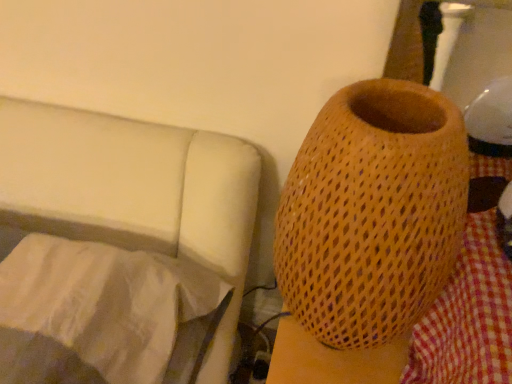
Question: Considering the relative positions of brown woven vase at right and white fabric at lower left in the image provided, is brown woven vase at right to the left of white fabric at lower left from the viewer's perspective?

Choices:
 (A) yes
 (B) no

Answer: (B)

Question: Is brown woven vase at right completely or partially outside of white fabric at lower left?

Choices:
 (A) yes
 (B) no

Answer: (A)

Question: Can you confirm if brown woven vase at right is shorter than white fabric at lower left?

Choices:
 (A) yes
 (B) no

Answer: (B)

Question: Is white fabric at lower left a part of brown woven vase at right?

Choices:
 (A) yes
 (B) no

Answer: (B)

Question: From a real-world perspective, is brown woven vase at right located higher than white fabric at lower left?

Choices:
 (A) no
 (B) yes

Answer: (B)

Question: From the image's perspective, is brown woven vase at right below white fabric at lower left?

Choices:
 (A) no
 (B) yes

Answer: (A)

Question: From the image's perspective, does white fabric at lower left appear lower than brown woven vase at right?

Choices:
 (A) yes
 (B) no

Answer: (A)

Question: From a real-world perspective, is white fabric at lower left physically below brown woven vase at right?

Choices:
 (A) no
 (B) yes

Answer: (B)

Question: Does white fabric at lower left have a greater height compared to brown woven vase at right?

Choices:
 (A) no
 (B) yes

Answer: (A)

Question: Considering the relative positions of white fabric at lower left and brown woven vase at right in the image provided, is white fabric at lower left to the right of brown woven vase at right from the viewer's perspective?

Choices:
 (A) yes
 (B) no

Answer: (B)

Question: Is white fabric at lower left positioned in front of brown woven vase at right?

Choices:
 (A) no
 (B) yes

Answer: (A)

Question: Is white fabric at lower left facing away from brown woven vase at right?

Choices:
 (A) no
 (B) yes

Answer: (A)

Question: From a real-world perspective, is brown woven vase at right physically located above or below white fabric at lower left?

Choices:
 (A) above
 (B) below

Answer: (A)